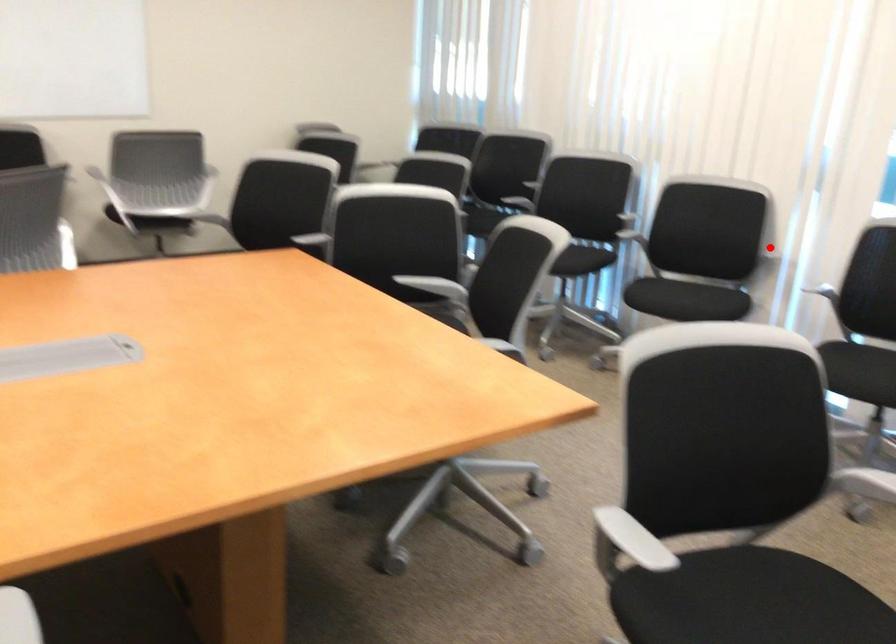
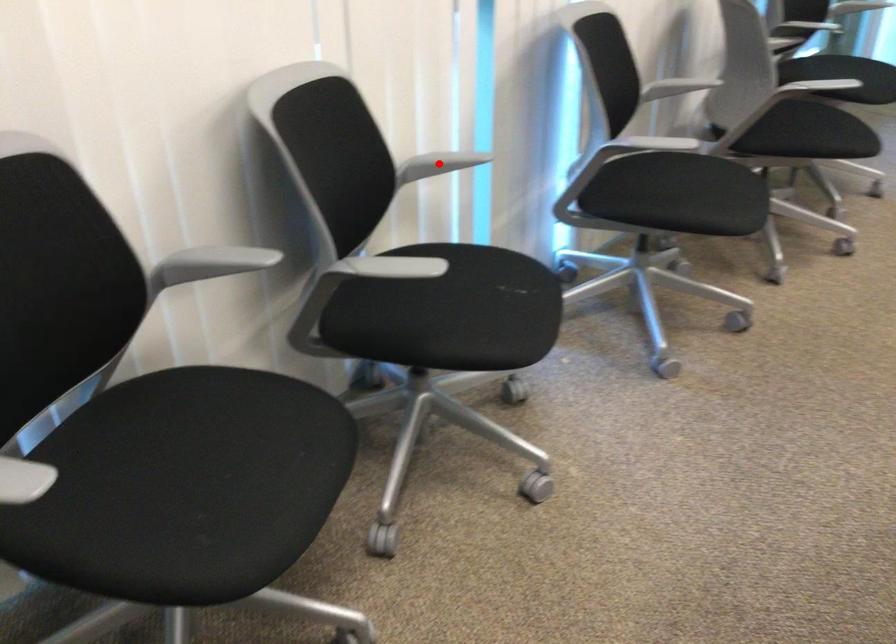
I am providing you with two images of the same scene from different viewpoints. A red point is marked on the first image and another point is marked on the second image. Is the marked point in image1 the same physical position as the marked point in image2?

Yes